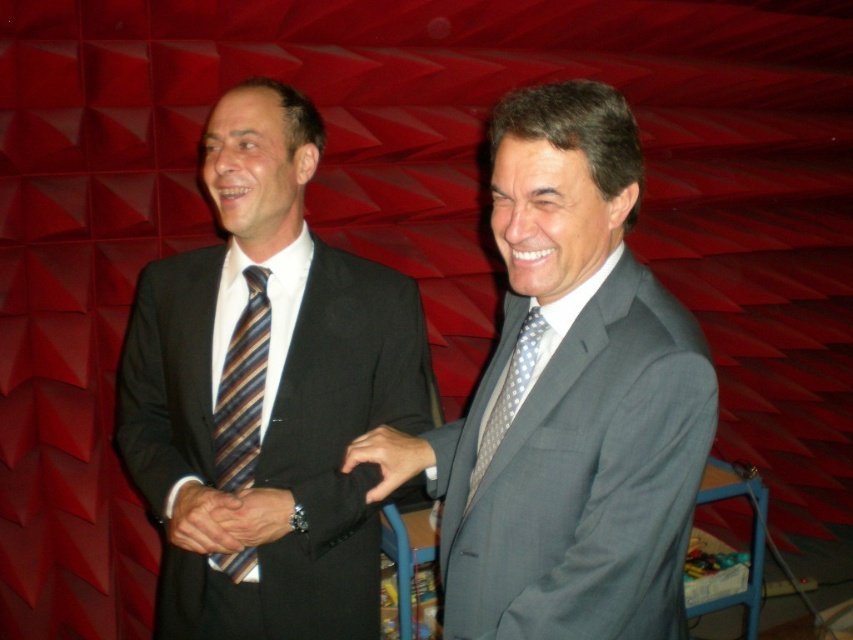
You are a fashion designer observing two men in the scene. One is wearing a matte black suit at left, and the other is wearing a matte black suit at center. Which man is positioned more to the left?

The matte black suit at left is positioned more to the left than the matte black suit at center.

You are a photographer setting up for a group photo. You need to arrange the matte black suit at left and the matte black suit at center so that they are the same height in the photo. What adjustment should you make to the camera or their positions?

Since the matte black suit at left is much taller than the matte black suit at center, you should lower the camera angle or have the matte black suit at left step down slightly to make them appear the same height in the photo.

You are organizing a charity event and need to arrange two items displayed in the image. The items are the smooth brown leather hand at center and the matte black suit at center. Since space is limited, which item should you choose to place first to ensure both can fit comfortably?

The smooth brown leather hand at center occupies less space than the matte black suit at center, so it should be placed first to ensure both can fit comfortably.